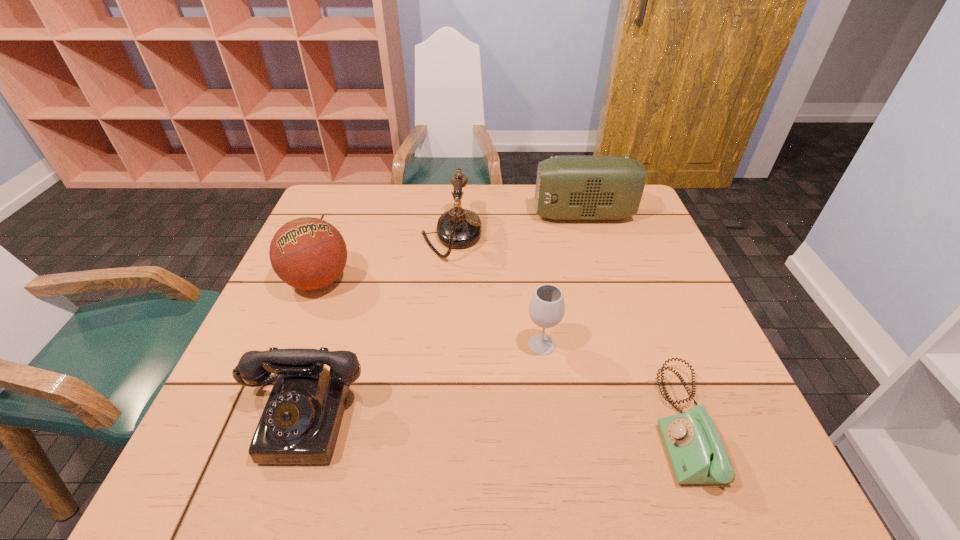
Image resolution: width=960 pixels, height=540 pixels. I want to click on telephone at the left edge, so click(300, 423).

At what (x,y) coordinates should I click in order to perform the action: click on radio_receiver that is at the right edge. Please return your answer as a coordinate pair (x, y). The height and width of the screenshot is (540, 960). Looking at the image, I should click on (567, 187).

You are a GUI agent. You are given a task and a screenshot of the screen. Output one action in this format:
    pyautogui.click(x=<x>, y=<y>)
    Task: Click on the telephone present at the right edge
    This screenshot has height=540, width=960.
    Given the screenshot: What is the action you would take?
    pyautogui.click(x=697, y=455)

The width and height of the screenshot is (960, 540). Identify the location of object present at the near left corner. (300, 423).

Identify the location of object that is at the far right corner. (567, 187).

Locate an element on the screen. This screenshot has width=960, height=540. object situated at the near right corner is located at coordinates (697, 455).

At what (x,y) coordinates should I click in order to perform the action: click on vacant space at the far edge. Please return your answer as a coordinate pair (x, y). Looking at the image, I should click on (x=510, y=194).

You are a GUI agent. You are given a task and a screenshot of the screen. Output one action in this format:
    pyautogui.click(x=<x>, y=<y>)
    Task: Click on the vacant region at the near edge of the desktop
    
    Given the screenshot: What is the action you would take?
    pyautogui.click(x=413, y=475)

Locate an element on the screen. The height and width of the screenshot is (540, 960). vacant space at the left edge of the desktop is located at coordinates (272, 337).

Identify the location of free space at the right edge of the desktop. The image size is (960, 540). (659, 241).